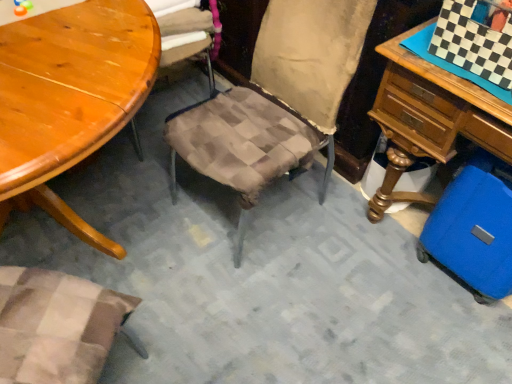
Question: Considering the relative sizes of blue hardshell suitcase at lower right and wooden table at upper left in the image provided, is blue hardshell suitcase at lower right wider than wooden table at upper left?

Choices:
 (A) no
 (B) yes

Answer: (A)

Question: Is blue hardshell suitcase at lower right in front of wooden table at upper left?

Choices:
 (A) no
 (B) yes

Answer: (A)

Question: Is wooden table at upper left at the back of blue hardshell suitcase at lower right?

Choices:
 (A) no
 (B) yes

Answer: (A)

Question: Does blue hardshell suitcase at lower right have a smaller size compared to wooden table at upper left?

Choices:
 (A) yes
 (B) no

Answer: (A)

Question: From a real-world perspective, is blue hardshell suitcase at lower right located higher than wooden table at upper left?

Choices:
 (A) yes
 (B) no

Answer: (B)

Question: Could wooden table at upper left be considered to be inside blue hardshell suitcase at lower right?

Choices:
 (A) no
 (B) yes

Answer: (A)

Question: Is wooden table at upper left positioned far away from blue hardshell suitcase at lower right?

Choices:
 (A) yes
 (B) no

Answer: (A)

Question: From a real-world perspective, is wooden table at upper left on blue hardshell suitcase at lower right?

Choices:
 (A) yes
 (B) no

Answer: (A)

Question: Considering the relative positions of wooden table at upper left and blue hardshell suitcase at lower right in the image provided, is wooden table at upper left in front of blue hardshell suitcase at lower right?

Choices:
 (A) yes
 (B) no

Answer: (A)

Question: Can you confirm if wooden table at upper left is thinner than blue hardshell suitcase at lower right?

Choices:
 (A) yes
 (B) no

Answer: (B)

Question: From a real-world perspective, is wooden table at upper left below blue hardshell suitcase at lower right?

Choices:
 (A) yes
 (B) no

Answer: (B)

Question: Can blue hardshell suitcase at lower right be found inside wooden table at upper left?

Choices:
 (A) yes
 (B) no

Answer: (B)

Question: In terms of width, does blue hardshell suitcase at lower right look wider or thinner when compared to wooden table at upper left?

Choices:
 (A) thin
 (B) wide

Answer: (A)